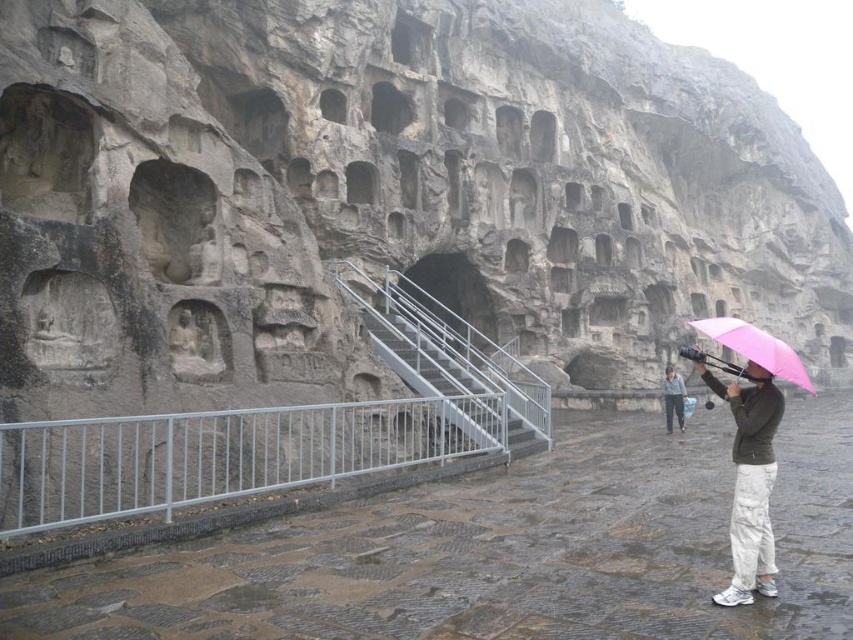
You are standing on the paved area in front of the rock face and want to walk towards the staircase. There are two points marked on your map as point 1 at coordinates point (109,429) and point 2 at coordinates point (757,522). Which point should you walk towards first to reach the staircase?

Point (109,429) is behind point (757,522), so you should walk towards point (757,522) first as it is closer to your current position on the paved area.

You are standing on the paved area in front of the rock face and want to reach the staircase. You see the white metal railing at lower center and the pink matte umbrella at lower right. Which object is closer to your current position?

The white metal railing at lower center is closer to your current position because it is to the left of the pink matte umbrella at lower right, which is further away.